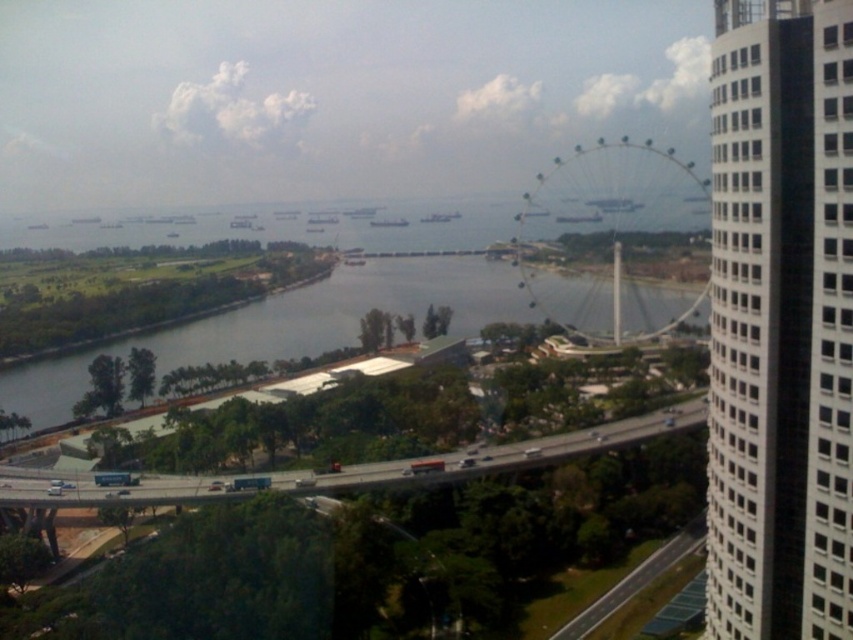
Question: Which object is closer to the camera taking this photo?

Choices:
 (A) green grass at lower left
 (B) metallic silver ferris wheel at center
 (C) white glass building at right

Answer: (C)

Question: Among these objects, which one is nearest to the camera?

Choices:
 (A) metallic ferris wheel at center
 (B) green grass at lower left
 (C) metallic silver ferris wheel at center
 (D) white glass building at right

Answer: (D)

Question: Is metallic silver ferris wheel at center bigger than green grass at lower left?

Choices:
 (A) no
 (B) yes

Answer: (A)

Question: From the image, what is the correct spatial relationship of metallic silver ferris wheel at center in relation to green grass at lower left?

Choices:
 (A) above
 (B) below

Answer: (A)

Question: Among these points, which one is nearest to the camera?

Choices:
 (A) (846, 328)
 (B) (479, 602)

Answer: (A)

Question: Is white glass building at right further to the viewer compared to metallic silver ferris wheel at center?

Choices:
 (A) yes
 (B) no

Answer: (B)